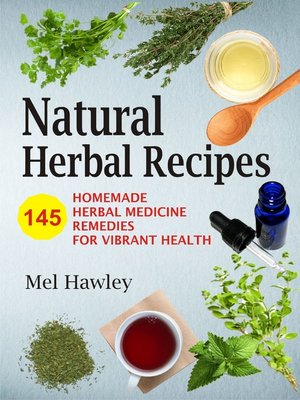
Locate an element on the screen. bottle is located at coordinates (273, 219).